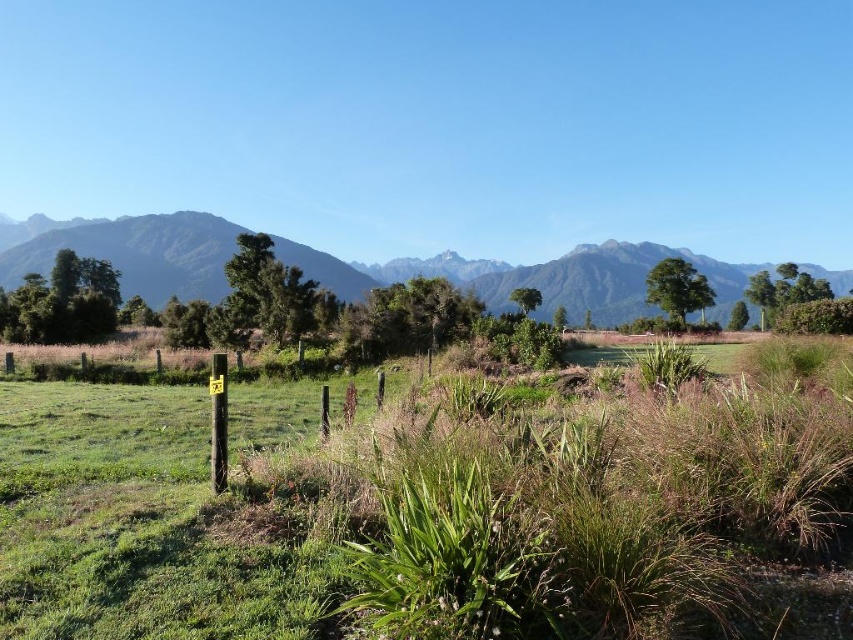
You are standing in the middle of the green grassy at center and want to walk towards the green grassy field at upper center. Which direction should you move to reach it?

To reach the green grassy field at upper center from the green grassy at center, you should move to the left, as the green grassy at center is positioned on the right side of the green grassy field at upper center.

You are a drone operator trying to navigate between the green grassy at center and the green grassy field at upper center. Which direction should you fly to move from the lower one to the upper one?

To move from the lower green grassy at center to the upper green grassy field at upper center, you should fly upward since the green grassy at center is positioned under the green grassy field at upper center.